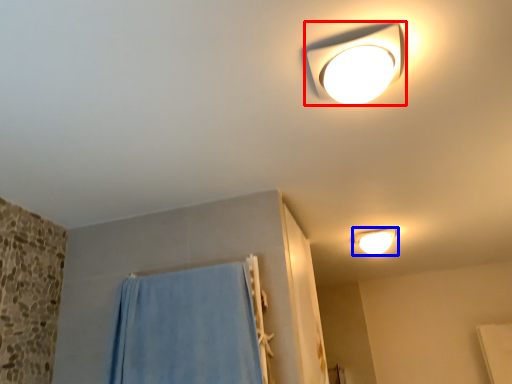
Question: Among these objects, which one is farthest to the camera, lamp (highlighted by a red box) or lamp (highlighted by a blue box)?

Choices:
 (A) lamp
 (B) lamp

Answer: (B)